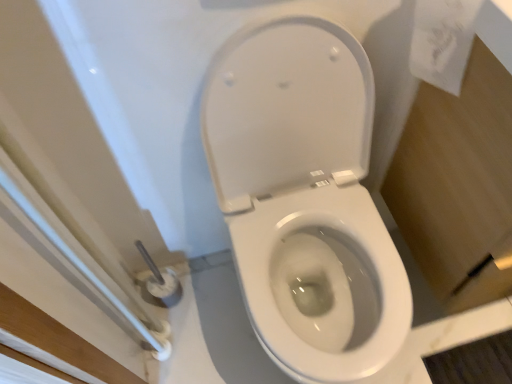
In the scene shown: Measure the distance between white glossy toilet at center and camera.

white glossy toilet at center is 28.46 inches away from camera.

Describe the element at coordinates (305, 197) in the screenshot. I see `white glossy toilet at center` at that location.

Identify the location of white glossy toilet at center. The height and width of the screenshot is (384, 512). (305, 197).

What do you see at coordinates (442, 41) in the screenshot? This screenshot has height=384, width=512. I see `white paper towel at upper right` at bounding box center [442, 41].

You are a GUI agent. You are given a task and a screenshot of the screen. Output one action in this format:
    pyautogui.click(x=<x>, y=<y>)
    Task: Click on the white paper towel at upper right
    The height and width of the screenshot is (384, 512).
    Given the screenshot: What is the action you would take?
    click(x=442, y=41)

Identify the location of white glossy toilet at center. The width and height of the screenshot is (512, 384). (305, 197).

Is white glossy toilet at center to the left of white paper towel at upper right from the viewer's perspective?

Yes.

Based on the photo, which object is further away from the camera taking this photo, white glossy toilet at center or white paper towel at upper right?

white paper towel at upper right is behind.

Consider the image. Which is nearer, (388, 336) or (458, 27)?

Point (388, 336).

From the image's perspective, which is below, white glossy toilet at center or white paper towel at upper right?

white glossy toilet at center appears lower in the image.

From a real-world perspective, is white glossy toilet at center physically below white paper towel at upper right?

Correct, in the physical world, white glossy toilet at center is lower than white paper towel at upper right.

Considering the sizes of white glossy toilet at center and white paper towel at upper right in the image, is white glossy toilet at center wider or thinner than white paper towel at upper right?

Considering their sizes, white glossy toilet at center looks broader than white paper towel at upper right.

Is white glossy toilet at center shorter than white paper towel at upper right?

No, white glossy toilet at center is not shorter than white paper towel at upper right.

Considering the relative sizes of white glossy toilet at center and white paper towel at upper right in the image provided, is white glossy toilet at center smaller than white paper towel at upper right?

Incorrect, white glossy toilet at center is not smaller in size than white paper towel at upper right.

Based on the photo, is white glossy toilet at center not inside white paper towel at upper right?

That's correct, white glossy toilet at center is outside of white paper towel at upper right.

Looking at this image, is white glossy toilet at center with white paper towel at upper right?

No, white glossy toilet at center is not touching white paper towel at upper right.

Is white paper towel at upper right at the back of white glossy toilet at center?

No, white glossy toilet at center is not facing away from white paper towel at upper right.

How many degrees apart are the facing directions of white glossy toilet at center and white paper towel at upper right?

0.059 degrees.

Measure the distance between white glossy toilet at center and white paper towel at upper right.

The distance of white glossy toilet at center from white paper towel at upper right is 38.48 centimeters.

This screenshot has height=384, width=512. Identify the location of toilet paper behind the white glossy toilet at center. (442, 41).

Does white paper towel at upper right appear on the right side of white glossy toilet at center?

Correct, you'll find white paper towel at upper right to the right of white glossy toilet at center.

Looking at this image, is the depth of white paper towel at upper right greater than that of white glossy toilet at center?

Yes, white paper towel at upper right is behind white glossy toilet at center.

Is point (459, 5) behind point (290, 218)?

No, it is in front of (290, 218).

From the image's perspective, which one is positioned higher, white paper towel at upper right or white glossy toilet at center?

white paper towel at upper right.

From a real-world perspective, is white paper towel at upper right positioned above or below white glossy toilet at center?

white paper towel at upper right is above white glossy toilet at center.

Is white paper towel at upper right wider or thinner than white glossy toilet at center?

Considering their sizes, white paper towel at upper right looks slimmer than white glossy toilet at center.

Between white paper towel at upper right and white glossy toilet at center, which one has more height?

With more height is white glossy toilet at center.

Looking at the image, does white paper towel at upper right seem bigger or smaller compared to white glossy toilet at center?

Clearly, white paper towel at upper right is smaller in size than white glossy toilet at center.

Would you say white paper towel at upper right is outside white glossy toilet at center?

That's correct, white paper towel at upper right is outside of white glossy toilet at center.

In the scene shown: Is white paper towel at upper right not close to white glossy toilet at center?

Actually, white paper towel at upper right and white glossy toilet at center are a little close together.

Is white paper towel at upper right aimed at white glossy toilet at center?

No, white paper towel at upper right is not facing towards white glossy toilet at center.

What's the angular difference between white paper towel at upper right and white glossy toilet at center's facing directions?

The angular difference between white paper towel at upper right and white glossy toilet at center is 0.059 degrees.

Measure the distance from white paper towel at upper right to white glossy toilet at center.

white paper towel at upper right and white glossy toilet at center are 15.15 inches apart from each other.

At what (x,y) coordinates should I click in order to perform the action: click on toilet paper above the white glossy toilet at center (from the image's perspective). Please return your answer as a coordinate pair (x, y). Image resolution: width=512 pixels, height=384 pixels. Looking at the image, I should click on (442, 41).

You are a GUI agent. You are given a task and a screenshot of the screen. Output one action in this format:
    pyautogui.click(x=<x>, y=<y>)
    Task: Click on the toilet paper on the right of white glossy toilet at center
    The height and width of the screenshot is (384, 512).
    Given the screenshot: What is the action you would take?
    pyautogui.click(x=442, y=41)

Where is `toilet paper above the white glossy toilet at center (from a real-world perspective)`? This screenshot has width=512, height=384. toilet paper above the white glossy toilet at center (from a real-world perspective) is located at coordinates (442, 41).